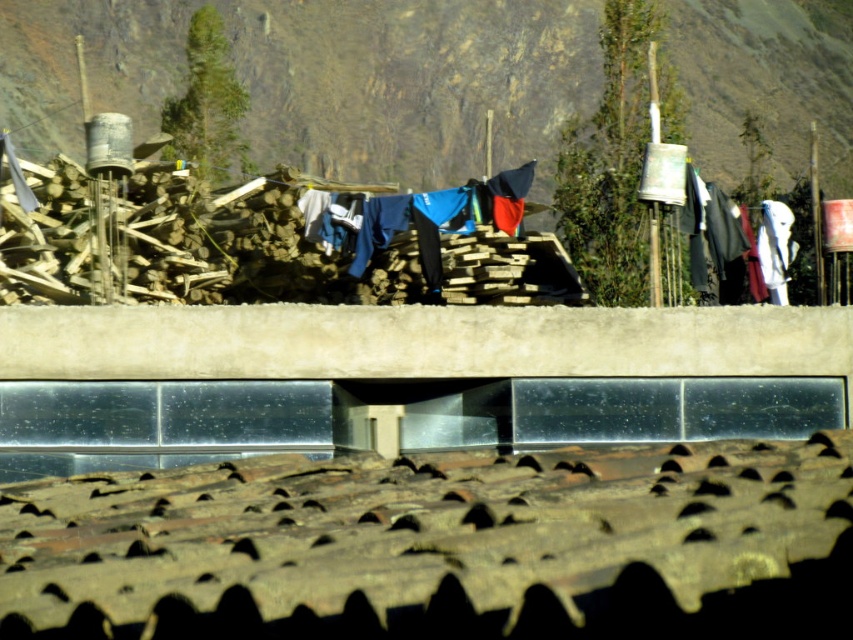
You are standing at the viewpoint of the image and want to move from the point at coordinates point (795, 524) to the point at coordinates point (422, 202). Which direction should you move relative to the scene?

To move from point (795, 524) to point (422, 202), you should move towards the upper left direction since point (795, 524) is in front of point (422, 202), indicating that the latter is located behind and to the upper left relative to the former.

What is the exact coordinate of the rugged rock mountain at upper center?

The rugged rock mountain at upper center is located at point (x=321, y=77).